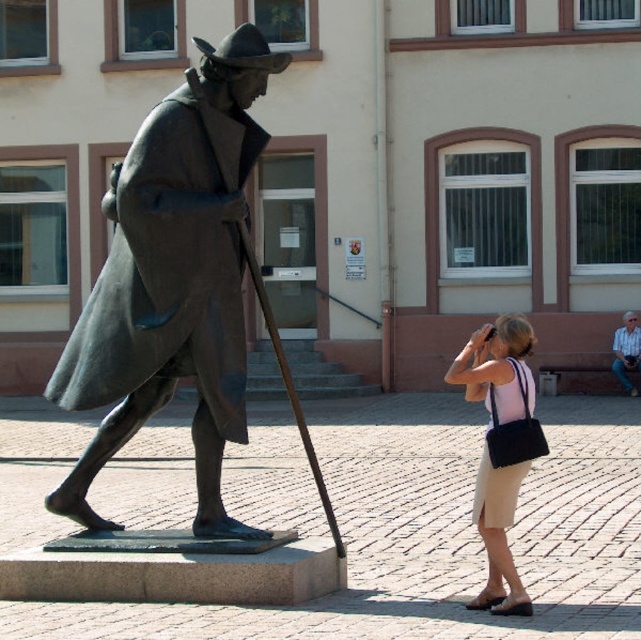
Question: Is bronze statue at left bigger than light blue shirt at right?

Choices:
 (A) no
 (B) yes

Answer: (B)

Question: Which object is farther from the camera taking this photo?

Choices:
 (A) light blue shirt at right
 (B) beige fabric skirt at lower right

Answer: (A)

Question: Which object appears farthest from the camera in this image?

Choices:
 (A) light blue shirt at right
 (B) beige fabric skirt at lower right

Answer: (A)

Question: Which point appears farthest from the camera in this image?

Choices:
 (A) pos(469,394)
 (B) pos(629,324)

Answer: (B)

Question: Is the position of bronze statue at left less distant than that of beige fabric skirt at lower right?

Choices:
 (A) no
 (B) yes

Answer: (A)

Question: Observing the image, what is the correct spatial positioning of beige fabric skirt at lower right in reference to light blue shirt at right?

Choices:
 (A) right
 (B) left

Answer: (B)